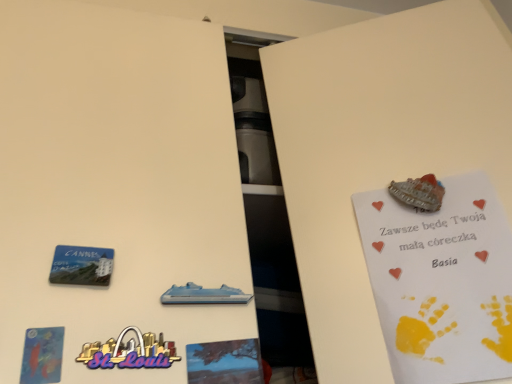
Question: Is blue plastic cruise ship at center in front of blue matte tree at center?

Choices:
 (A) no
 (B) yes

Answer: (A)

Question: From the image's perspective, does blue plastic cruise ship at center appear higher than blue matte tree at center?

Choices:
 (A) yes
 (B) no

Answer: (A)

Question: Does blue plastic cruise ship at center touch blue matte tree at center?

Choices:
 (A) no
 (B) yes

Answer: (B)

Question: Is blue plastic cruise ship at center taller than blue matte tree at center?

Choices:
 (A) yes
 (B) no

Answer: (B)

Question: Is blue matte tree at center a part of blue plastic cruise ship at center?

Choices:
 (A) no
 (B) yes

Answer: (A)

Question: Is blue plastic cruise ship at center thinner than blue matte tree at center?

Choices:
 (A) yes
 (B) no

Answer: (A)

Question: Is white paper postcard at upper right, which is the 1th postcard in back-to-front order, thinner than blue plastic cruise ship at center?

Choices:
 (A) no
 (B) yes

Answer: (A)

Question: Is the position of white paper postcard at upper right, which is the 1th postcard in back-to-front order, more distant than that of blue plastic cruise ship at center?

Choices:
 (A) yes
 (B) no

Answer: (B)

Question: From a real-world perspective, does white paper postcard at upper right, which is the 1th postcard in back-to-front order, stand above blue plastic cruise ship at center?

Choices:
 (A) yes
 (B) no

Answer: (A)

Question: Does white paper postcard at upper right, which is counted as the first postcard, starting from the right, touch blue plastic cruise ship at center?

Choices:
 (A) yes
 (B) no

Answer: (B)

Question: Is white paper postcard at upper right, which is counted as the first postcard, starting from the right, shorter than blue plastic cruise ship at center?

Choices:
 (A) no
 (B) yes

Answer: (A)

Question: Does white paper postcard at upper right, which is the 1th postcard in back-to-front order, have a smaller size compared to blue plastic cruise ship at center?

Choices:
 (A) yes
 (B) no

Answer: (B)

Question: From a real-world perspective, is matte blue postcard at lower left, acting as the second postcard starting from the right, on top of blue plastic cruise ship at center?

Choices:
 (A) yes
 (B) no

Answer: (B)